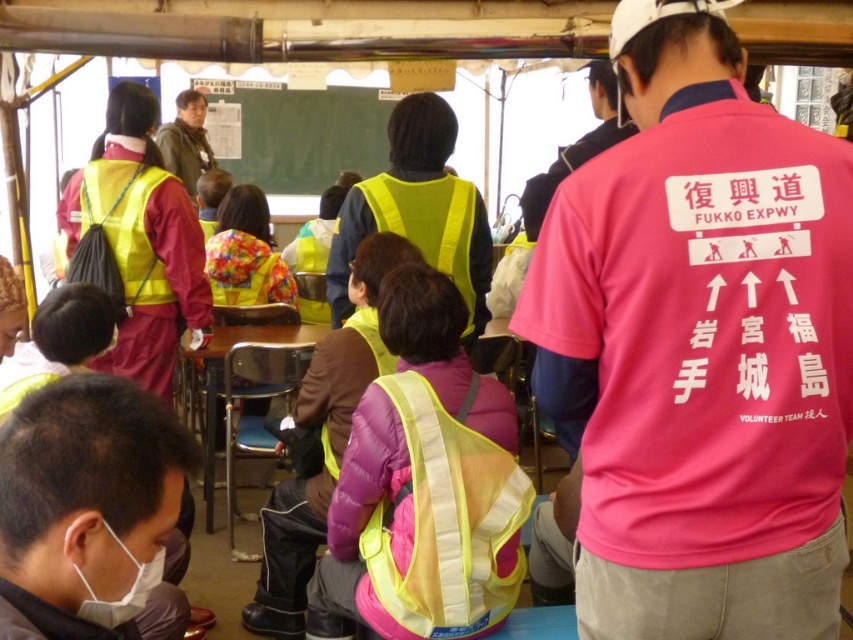
Question: Which point is closer to the camera?

Choices:
 (A) (490, 628)
 (B) (398, 179)

Answer: (A)

Question: In this image, where is yellow mesh safety vest at center located relative to yellow fabric safety vest at center?

Choices:
 (A) right
 (B) left

Answer: (B)

Question: In this image, where is yellow fabric safety vest at center located relative to wooden table at center?

Choices:
 (A) right
 (B) left

Answer: (A)

Question: Which object is closer to the camera taking this photo?

Choices:
 (A) yellow mesh safety vest at center
 (B) high-visibility yellow vest at center
 (C) pink fabric shirt at center

Answer: (C)

Question: Is high-visibility yellow vest at center thinner than pink fabric shirt at upper center?

Choices:
 (A) no
 (B) yes

Answer: (A)

Question: Which of the following is the farthest from the observer?

Choices:
 (A) (42, 397)
 (B) (776, 300)

Answer: (B)